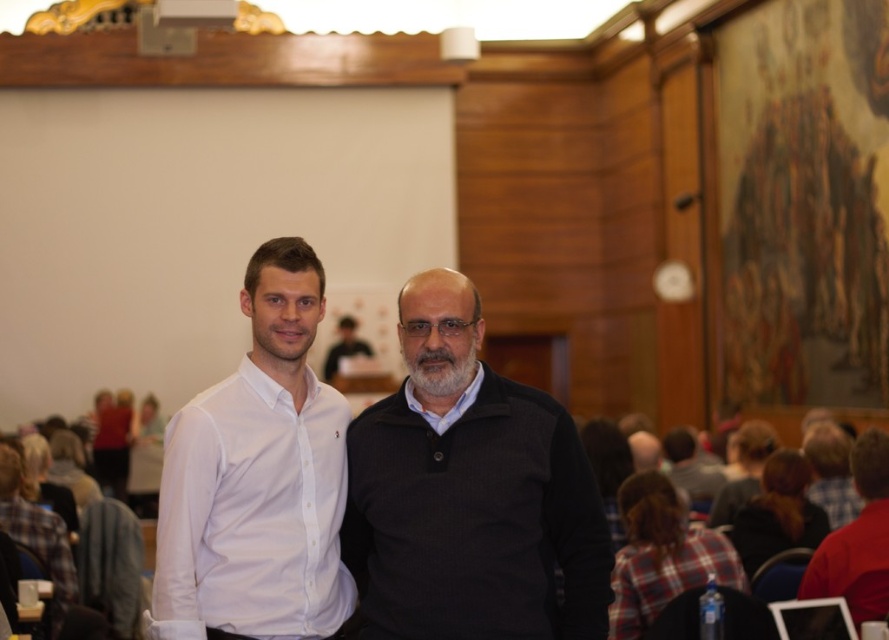
Question: Which of the following is the farthest from the observer?

Choices:
 (A) (863, 547)
 (B) (267, 397)

Answer: (B)

Question: Can you confirm if dark gray sweater at center is positioned below red matte shirt at lower right?

Choices:
 (A) no
 (B) yes

Answer: (A)

Question: Based on their relative distances, which object is farther from the white matte shirt at center?

Choices:
 (A) red matte shirt at lower right
 (B) dark gray sweater at center

Answer: (A)

Question: Does white matte shirt at center appear over red matte shirt at lower right?

Choices:
 (A) yes
 (B) no

Answer: (A)

Question: Can you confirm if dark gray sweater at center is wider than white matte shirt at center?

Choices:
 (A) yes
 (B) no

Answer: (A)

Question: Which point is closer to the camera?

Choices:
 (A) white matte shirt at center
 (B) dark gray sweater at center

Answer: (A)